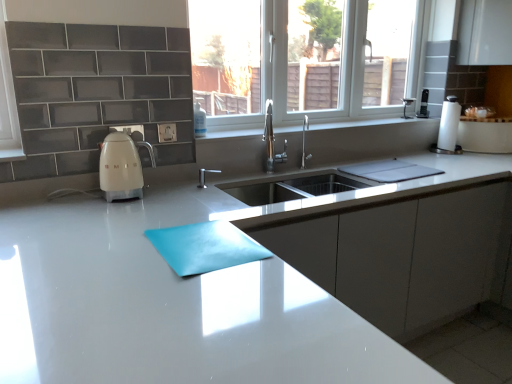
Question: From the image's perspective, is white glossy window sill at center located above or below polished chrome tap at center?

Choices:
 (A) above
 (B) below

Answer: (A)

Question: From their relative heights in the image, would you say white glossy window sill at center is taller or shorter than polished chrome tap at center?

Choices:
 (A) tall
 (B) short

Answer: (B)

Question: Which object is the farthest from the white glossy kettle at left?

Choices:
 (A) transparent glass window at center
 (B) white glossy countertop at center
 (C) white paper towel at right
 (D) clear plastic soap dispenser at upper center
 (E) white glossy window sill at center

Answer: (C)

Question: Which object is positioned farthest from the white glossy window sill at center?

Choices:
 (A) white paper towel at right
 (B) polished chrome tap at center
 (C) transparent glass window at center
 (D) clear plastic soap dispenser at upper center
 (E) white glossy kettle at left

Answer: (E)